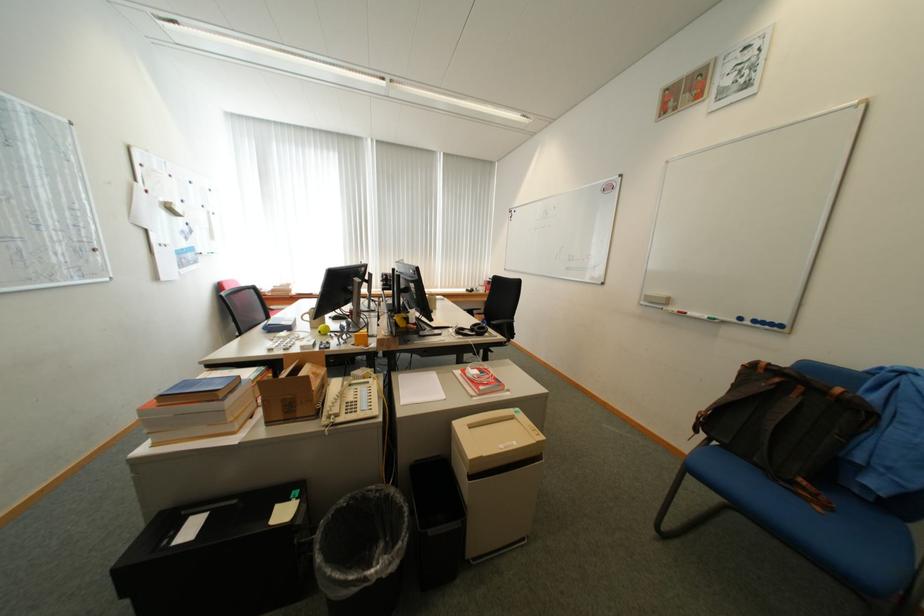
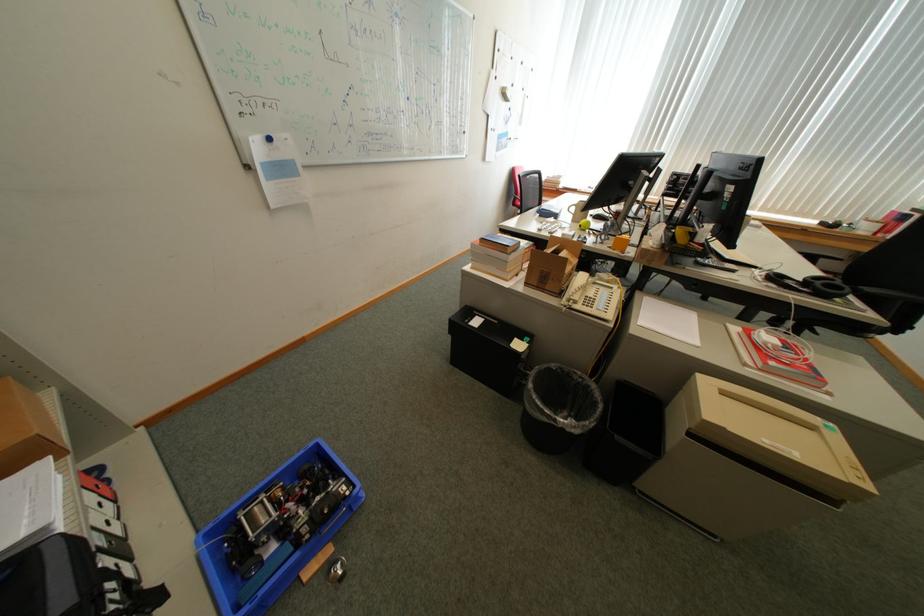
In the second image, find the point that corresponds to point 489,395 in the first image.

(770, 371)